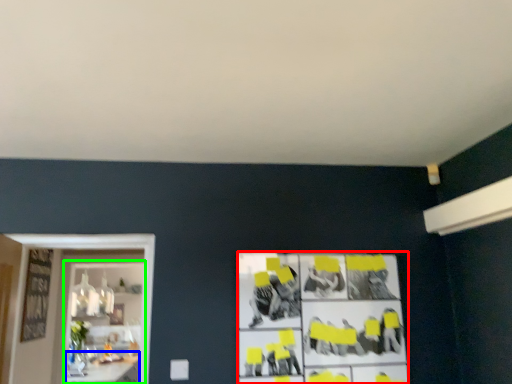
Question: Estimate the real-world distances between objects in this image. Which object is closer to poster (highlighted by a red box), table (highlighted by a blue box) or shelf (highlighted by a green box)?

Choices:
 (A) table
 (B) shelf

Answer: (A)